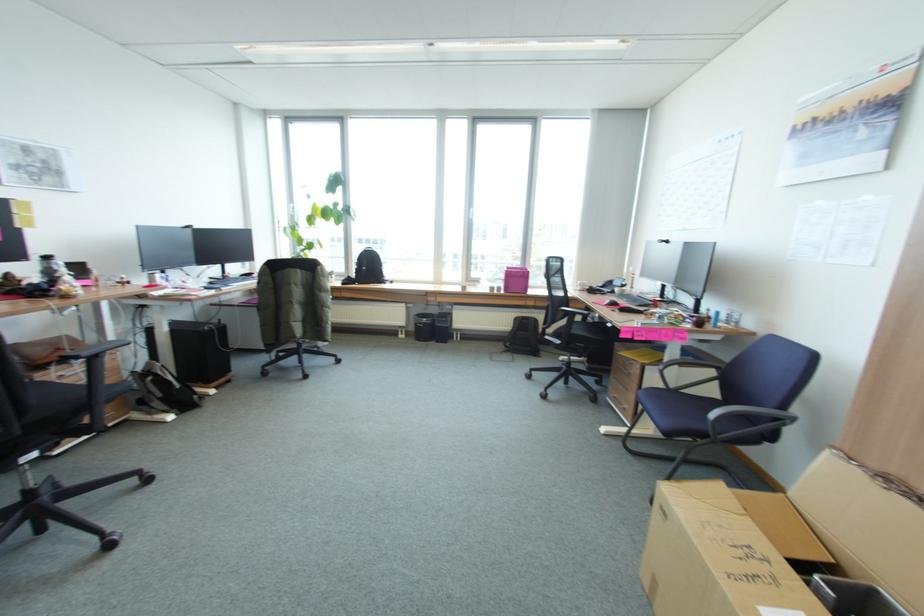
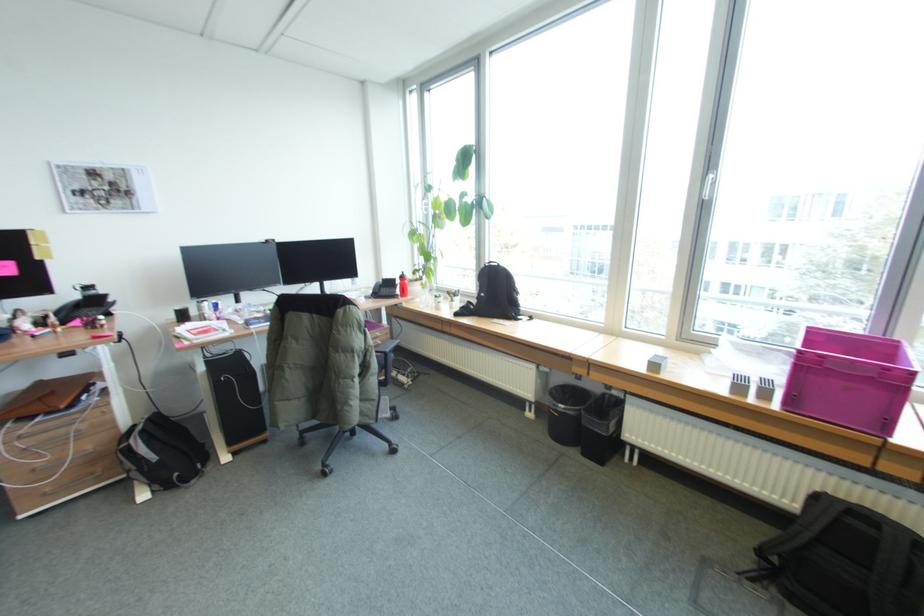
In the second image, find the point that corresponds to the point at 164,375 in the first image.

(135, 444)